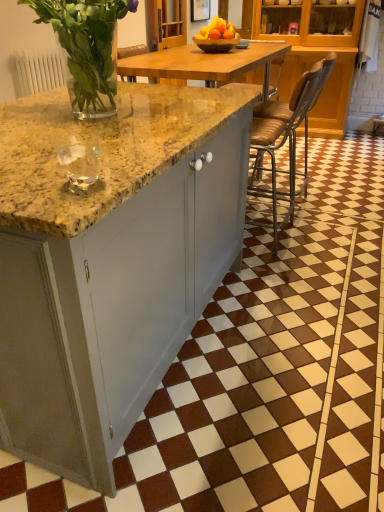
The width and height of the screenshot is (384, 512). I want to click on free space in front of metallic brown bar stool at center, so click(286, 272).